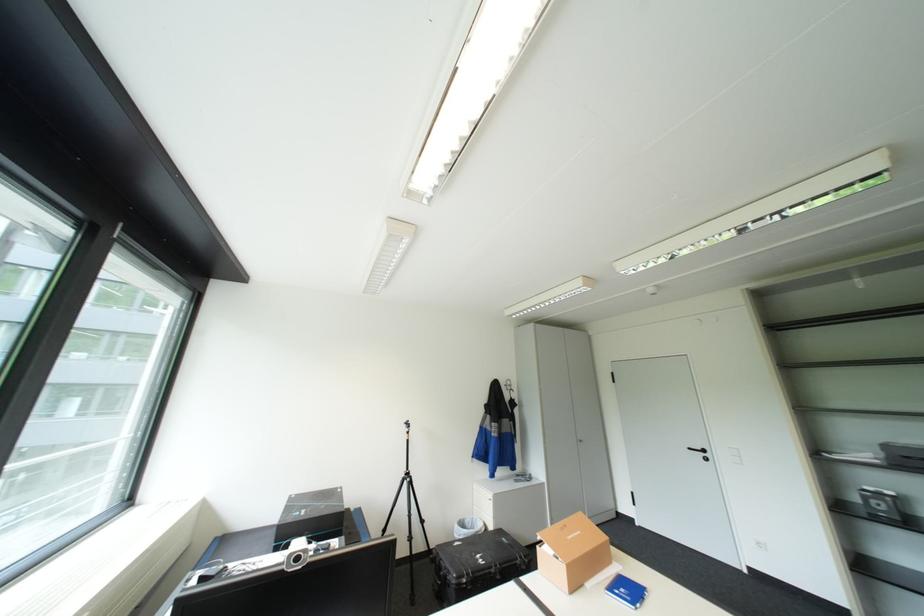
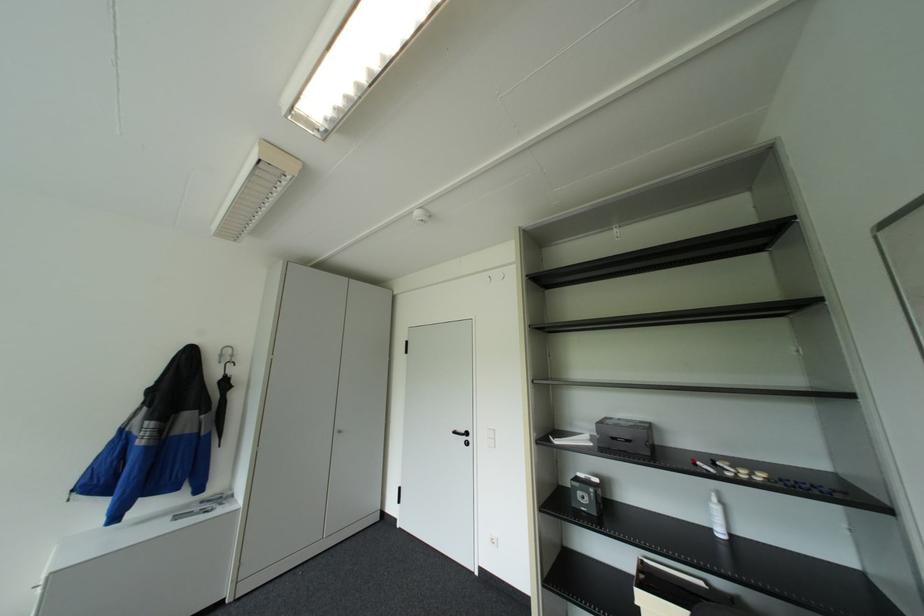
Where in the second image is the point corresponding to point 888,504 from the first image?

(591, 496)